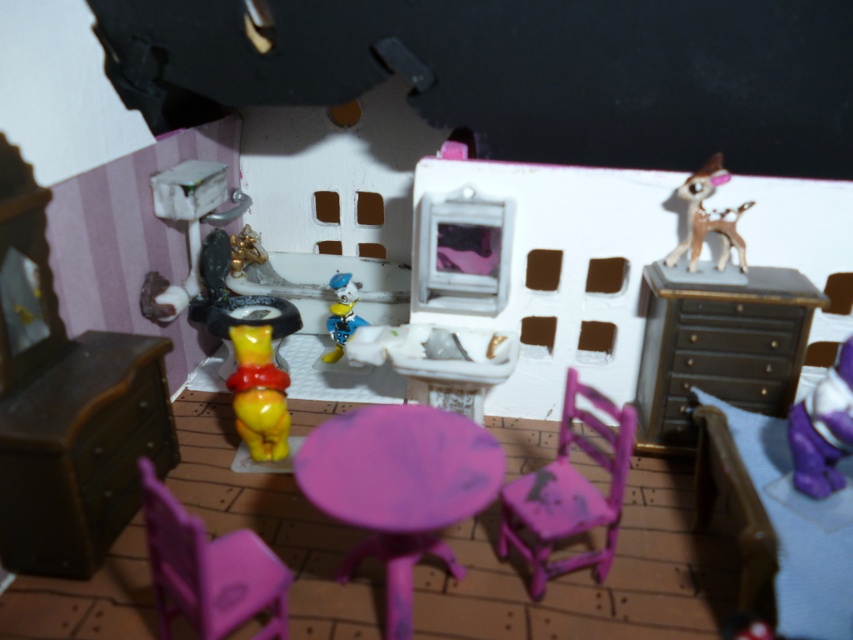
Question: Among these points, which one is farthest from the camera?

Choices:
 (A) (698, 195)
 (B) (352, 328)

Answer: (B)

Question: Observing the image, what is the correct spatial positioning of matte brown dresser at upper right in reference to matte plastic chair at center?

Choices:
 (A) left
 (B) right

Answer: (B)

Question: Does matte plastic chair at center have a greater width compared to purple fabric bag at lower right?

Choices:
 (A) yes
 (B) no

Answer: (A)

Question: Which object is the closest to the purple matte table at center?

Choices:
 (A) purple fabric bag at lower right
 (B) matte pink plastic chair at lower left
 (C) matte brown dresser at lower left

Answer: (B)

Question: Considering the real-world distances, which object is closest to the purple fabric bag at lower right?

Choices:
 (A) shiny blue plastic toy at center
 (B) brown glossy deer at upper right
 (C) matte plastic chair at center

Answer: (C)

Question: Is matte brown dresser at upper right to the left of purple fabric bag at lower right from the viewer's perspective?

Choices:
 (A) yes
 (B) no

Answer: (A)